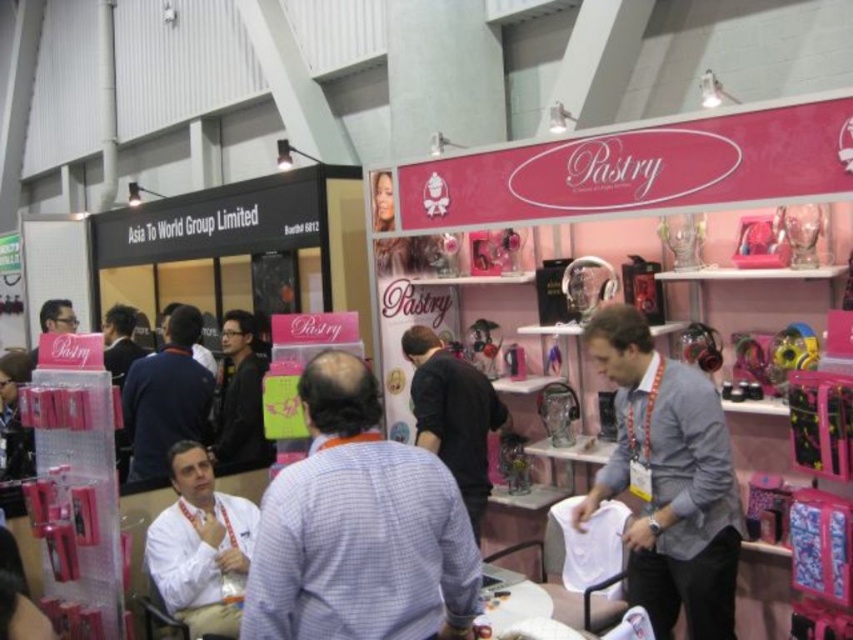
You are organizing a photoshoot and need to place the white matte shirt at lower left and the matte black jacket at center in a display case. Which item should you choose if you want to use less space in the display case?

You should choose the white matte shirt at lower left because it occupies less space than the matte black jacket at center.

You are at a trade show booth and need to pack two shirts into a narrow box. The gray fabric shirt at center and the black matte shirt at center are both in the center. Which shirt should you choose to fit better in the box if you can only take one?

The black matte shirt at center is narrower than the gray fabric shirt at center, so it would fit better in the narrow box.